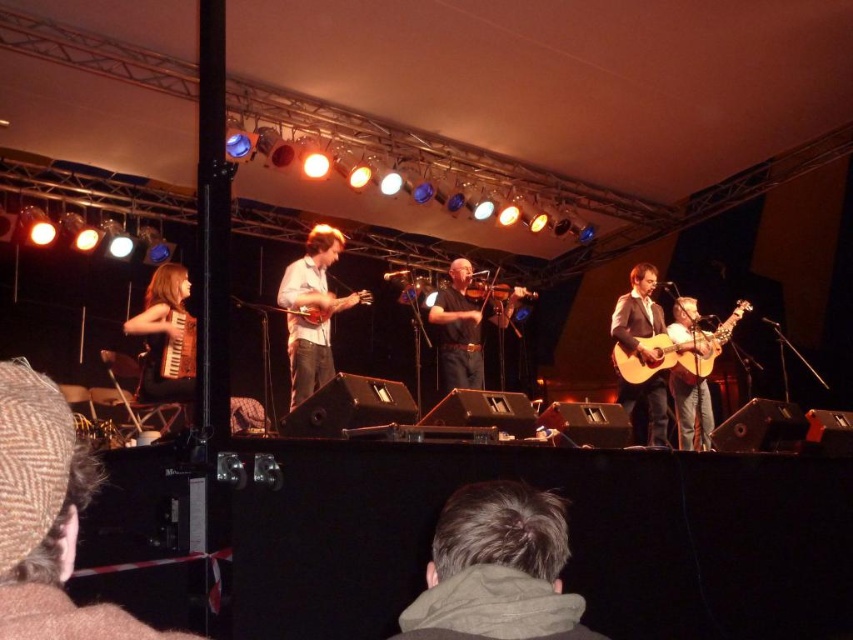
Question: Is white matte guitar at center in front of acoustic wood guitar at right?

Choices:
 (A) yes
 (B) no

Answer: (A)

Question: Which point is closer to the camera taking this photo?

Choices:
 (A) (316, 260)
 (B) (476, 372)
 (C) (724, 323)

Answer: (A)

Question: Does matte brown acoustic guitar at center lie in front of acoustic wood guitar at right?

Choices:
 (A) yes
 (B) no

Answer: (A)

Question: Which point is closer to the camera taking this photo?

Choices:
 (A) (573, 634)
 (B) (193, 346)
 (C) (192, 365)

Answer: (A)

Question: Does brown woolen hat at lower left have a lesser width compared to dark brown hair at center?

Choices:
 (A) yes
 (B) no

Answer: (B)

Question: Which of the following is the closest to the observer?

Choices:
 (A) brown wood accordion at lower left
 (B) wooden violin at center

Answer: (A)